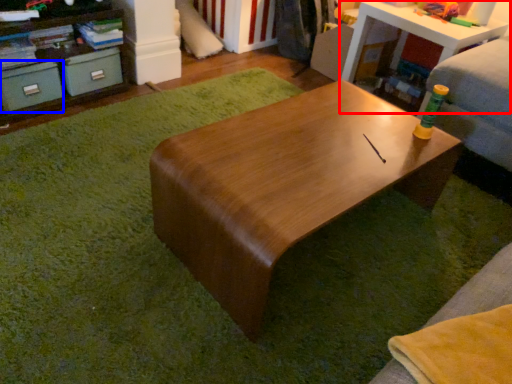
Question: Which object is closer to the camera taking this photo, table (highlighted by a red box) or drawer (highlighted by a blue box)?

Choices:
 (A) table
 (B) drawer

Answer: (B)